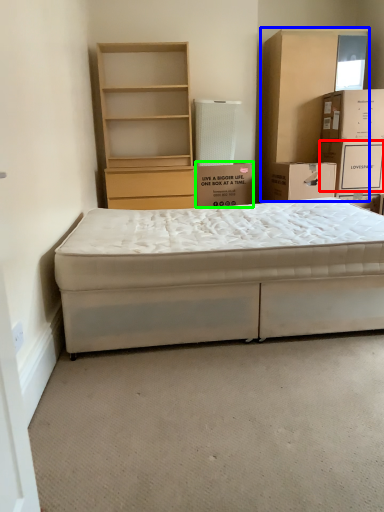
Question: Which is nearer to the storage box (highlighted by a red box)? cabinetry (highlighted by a blue box) or box (highlighted by a green box).

Choices:
 (A) cabinetry
 (B) box

Answer: (A)